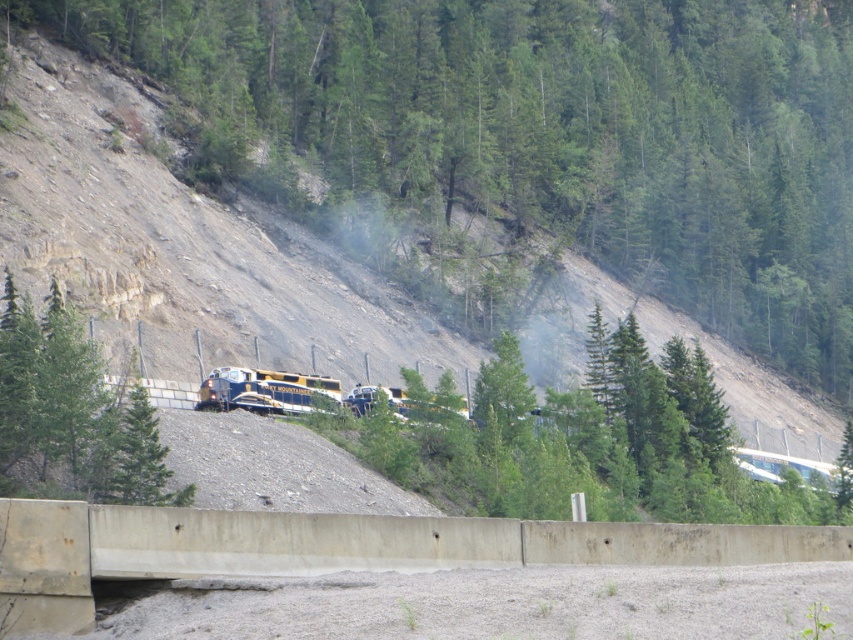
Question: Can you confirm if green leafy tree at center is positioned to the left of yellow and blue painted locomotive at center?

Choices:
 (A) yes
 (B) no

Answer: (B)

Question: Is green leafy tree at center to the left of yellow and blue painted locomotive at center from the viewer's perspective?

Choices:
 (A) no
 (B) yes

Answer: (A)

Question: Which point appears farthest from the camera in this image?

Choices:
 (A) (109, 403)
 (B) (811, 93)
 (C) (287, 397)

Answer: (B)

Question: Which of the following is the closest to the observer?

Choices:
 (A) green leafy tree at center
 (B) yellow and blue painted locomotive at center

Answer: (B)

Question: Among these points, which one is nearest to the camera?

Choices:
 (A) (728, 275)
 (B) (281, 388)

Answer: (B)

Question: Does green matte tree at center appear under yellow and blue painted locomotive at center?

Choices:
 (A) no
 (B) yes

Answer: (A)